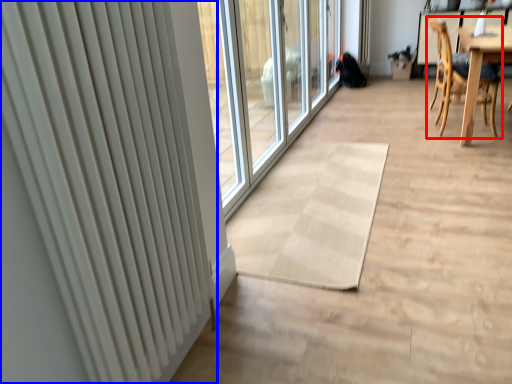
Question: Which object is closer to the camera taking this photo, chair (highlighted by a red box) or radiator (highlighted by a blue box)?

Choices:
 (A) chair
 (B) radiator

Answer: (B)